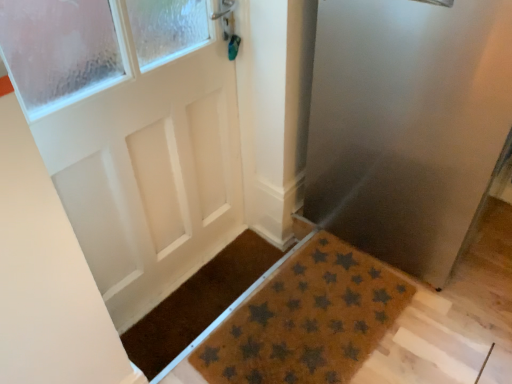
Question: Which direction should I rotate to look at brown coir mat at center, acting as the second doormat starting from the right, — up or down?

Choices:
 (A) down
 (B) up

Answer: (A)

Question: Does brown coir mat with star pattern at lower center, the second doormat viewed from the left, have a lesser height compared to brown textured mat at lower right?

Choices:
 (A) no
 (B) yes

Answer: (B)

Question: Is brown coir mat with star pattern at lower center, the first doormat from the right, taller than brown textured mat at lower right?

Choices:
 (A) no
 (B) yes

Answer: (A)

Question: Is brown coir mat with star pattern at lower center, the first doormat from the right, aimed at brown textured mat at lower right?

Choices:
 (A) yes
 (B) no

Answer: (B)

Question: From the image's perspective, would you say brown coir mat with star pattern at lower center, the first doormat from the right, is shown under brown textured mat at lower right?

Choices:
 (A) no
 (B) yes

Answer: (B)

Question: Is brown coir mat with star pattern at lower center, the second doormat viewed from the left, directly adjacent to brown textured mat at lower right?

Choices:
 (A) no
 (B) yes

Answer: (A)

Question: From a real-world perspective, is brown coir mat at center, acting as the second doormat starting from the right, on top of brown textured mat at lower right?

Choices:
 (A) no
 (B) yes

Answer: (A)

Question: Can you confirm if brown coir mat at center, acting as the second doormat starting from the right, is taller than brown textured mat at lower right?

Choices:
 (A) yes
 (B) no

Answer: (B)

Question: Does brown coir mat at center, acting as the second doormat starting from the right, have a smaller size compared to brown textured mat at lower right?

Choices:
 (A) yes
 (B) no

Answer: (A)

Question: Considering the relative positions of brown coir mat at center, which is the 1th doormat in left-to-right order, and brown textured mat at lower right in the image provided, is brown coir mat at center, which is the 1th doormat in left-to-right order, in front of brown textured mat at lower right?

Choices:
 (A) yes
 (B) no

Answer: (B)

Question: Is brown coir mat at center, which is the 1th doormat in left-to-right order, wider than brown textured mat at lower right?

Choices:
 (A) yes
 (B) no

Answer: (B)

Question: Is brown coir mat at center, which is the 1th doormat in left-to-right order, positioned behind brown textured mat at lower right?

Choices:
 (A) no
 (B) yes

Answer: (B)

Question: Is brown textured mat at lower right further to the viewer compared to brown coir mat at center, acting as the second doormat starting from the right?

Choices:
 (A) no
 (B) yes

Answer: (A)